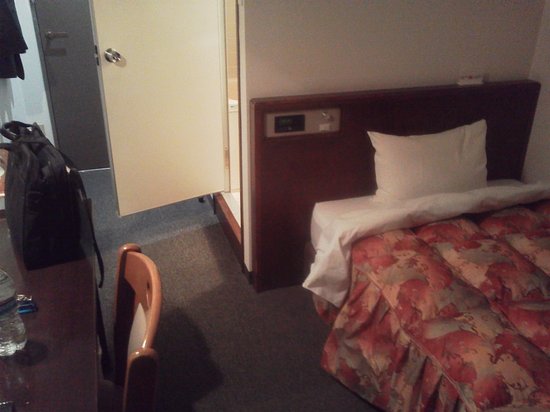
You are a GUI agent. You are given a task and a screenshot of the screen. Output one action in this format:
    pyautogui.click(x=<x>, y=<y>)
    Task: Click on the door hinge
    This screenshot has width=550, height=412.
    Given the screenshot: What is the action you would take?
    pyautogui.click(x=226, y=155)